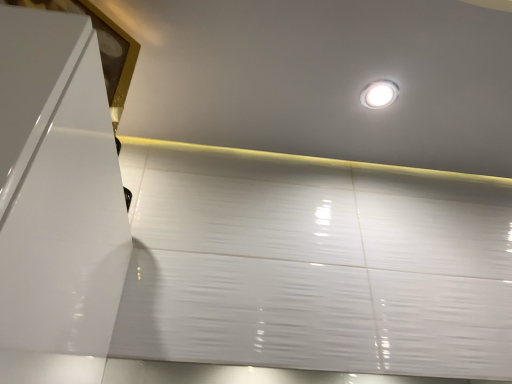
The height and width of the screenshot is (384, 512). Describe the element at coordinates (379, 94) in the screenshot. I see `white glossy light fixture at upper center` at that location.

Identify the location of white glossy light fixture at upper center. (379, 94).

What is the approximate width of white glossy light fixture at upper center?

white glossy light fixture at upper center is 4.00 inches wide.

Where is `white glossy light fixture at upper center`? white glossy light fixture at upper center is located at coordinates (379, 94).